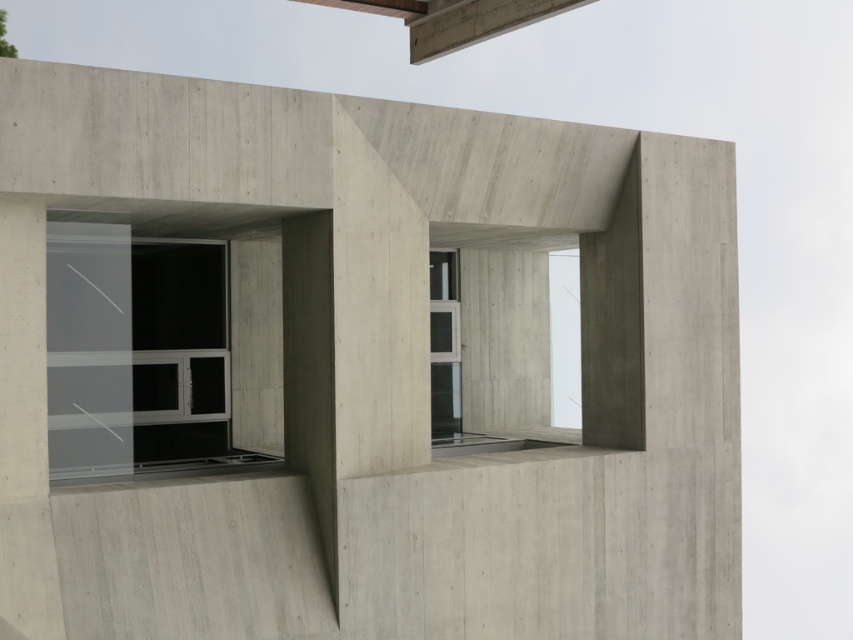
Does transparent glass window at center appear on the left side of clear glass window at center?

Yes, transparent glass window at center is to the left of clear glass window at center.

From the picture: Is transparent glass window at center to the right of clear glass window at center from the viewer's perspective?

In fact, transparent glass window at center is to the left of clear glass window at center.

The height and width of the screenshot is (640, 853). I want to click on transparent glass window at center, so click(x=137, y=353).